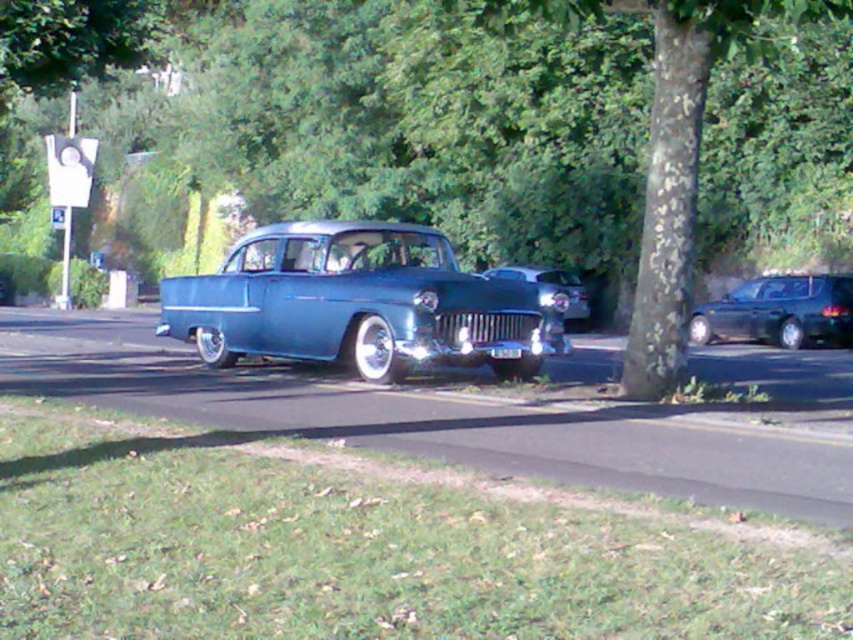
You are a delivery person trying to read the license plate of the shiny chrome car at center. Since you are standing in front of the car, can you see the white plastic license plate at center from your current position?

The white plastic license plate at center is behind the shiny chrome car at center, so you cannot see it from your current position in front of the car.

You are a photographer wanting to capture both the metallic blue pickup truck at center and the shiny chrome car at center in a single shot. Based on their positions, which vehicle should you focus on first to ensure both are in frame?

You should focus on the shiny chrome car at center first because the metallic blue pickup truck at center is to its left, so positioning the camera to include both would require framing from the left edge to the right edge, starting with the shiny chrome car at center as the central point.

You are a delivery person trying to park your van between the metallic blue pickup truck at center and the shiny black sedan at right. Can your van, which is 1.8 meters tall, fit in the space between them?

The metallic blue pickup truck at center is taller than the shiny black sedan at right. Since the pickup truck is taller, the available vertical space between them would depend on the sedan. However, without knowing the sedan height, we cannot confirm if 1.8 meters fits. Please check the sedan height first.